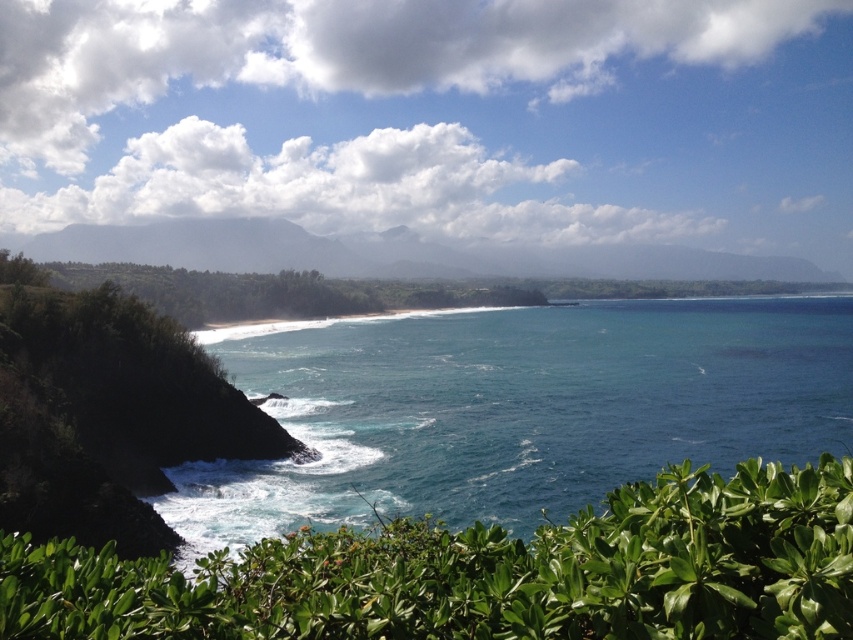
This screenshot has height=640, width=853. Find the location of `blue glossy water at center`. blue glossy water at center is located at coordinates (515, 410).